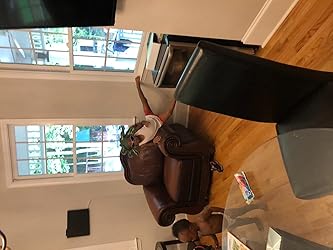
The width and height of the screenshot is (333, 250). Find the location of `windows`. windows is located at coordinates (78, 142), (76, 44).